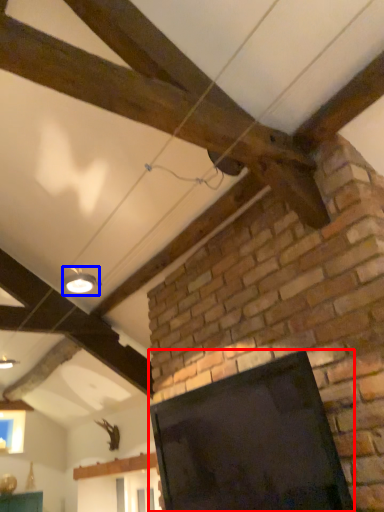
Question: Which of the following is the closest to the observer, screen (highlighted by a red box) or light fixture (highlighted by a blue box)?

Choices:
 (A) screen
 (B) light fixture

Answer: (A)